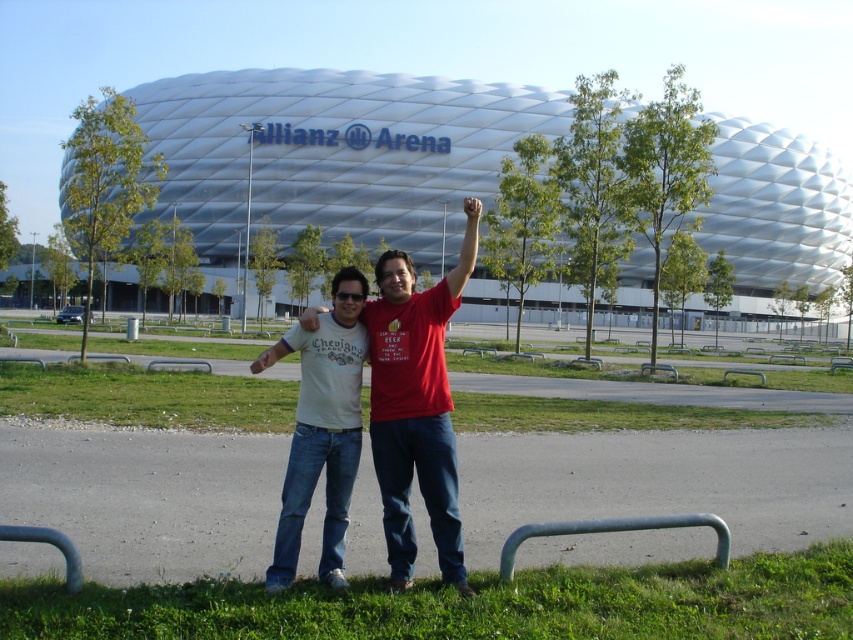
Based on the photo, which is more to the left, matte red t-shirt at center or light beige cotton t-shirt at center?

light beige cotton t-shirt at center is more to the left.

Between matte red t-shirt at center and light beige cotton t-shirt at center, which one has more height?

matte red t-shirt at center is taller.

Is point (407, 499) positioned behind point (334, 428)?

Yes, it is behind point (334, 428).

The width and height of the screenshot is (853, 640). What are the coordinates of `matte red t-shirt at center` in the screenshot? It's located at (416, 406).